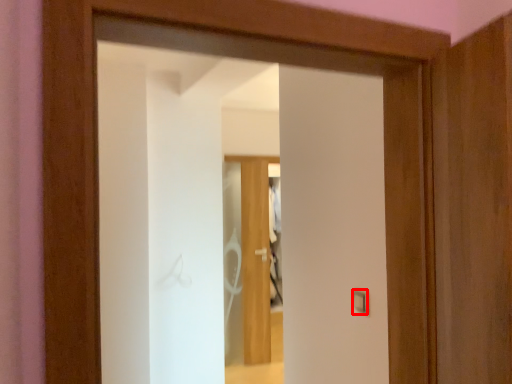
Question: Considering the relative positions of light switch (annotated by the red box) and door in the image provided, where is light switch (annotated by the red box) located with respect to the staircase?

Choices:
 (A) right
 (B) left

Answer: (A)